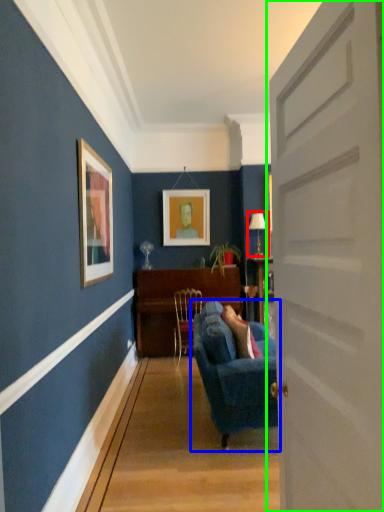
Question: Which object is the farthest from lamp (highlighted by a red box)? Choose among these: studio couch (highlighted by a blue box) or door (highlighted by a green box).

Choices:
 (A) studio couch
 (B) door

Answer: (B)